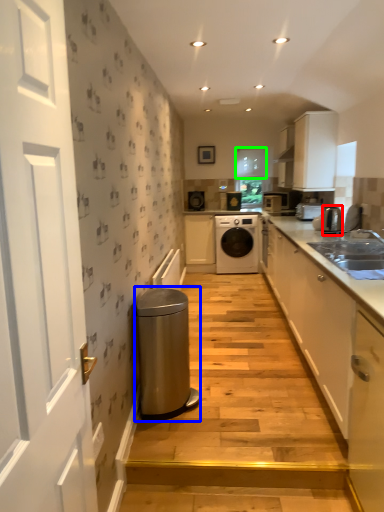
Question: Which object is positioned closest to appliance (highlighted by a red box)? Select from water heater (highlighted by a blue box) and window (highlighted by a green box).

Choices:
 (A) water heater
 (B) window

Answer: (A)